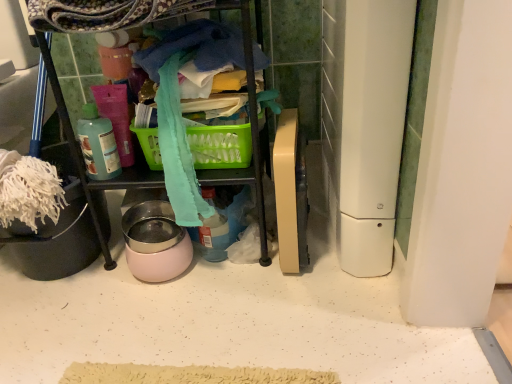
Question: Is translucent plastic bottle at upper left further to camera compared to green plastic picnic basket at center?

Choices:
 (A) yes
 (B) no

Answer: (B)

Question: Is translucent plastic bottle at upper left to the right of green plastic picnic basket at center from the viewer's perspective?

Choices:
 (A) yes
 (B) no

Answer: (B)

Question: From a real-world perspective, is translucent plastic bottle at upper left located higher than green plastic picnic basket at center?

Choices:
 (A) yes
 (B) no

Answer: (A)

Question: From the image's perspective, is translucent plastic bottle at upper left over green plastic picnic basket at center?

Choices:
 (A) yes
 (B) no

Answer: (B)

Question: Is translucent plastic bottle at upper left at the left side of green plastic picnic basket at center?

Choices:
 (A) yes
 (B) no

Answer: (A)

Question: Does translucent plastic bottle at upper left lie in front of green plastic picnic basket at center?

Choices:
 (A) no
 (B) yes

Answer: (B)

Question: Is translucent plastic bottle at upper left outside white plastic appliance at right, the 2th appliance from the left?

Choices:
 (A) no
 (B) yes

Answer: (B)

Question: Are translucent plastic bottle at upper left and white plastic appliance at right, the 2th appliance from the left, far apart?

Choices:
 (A) yes
 (B) no

Answer: (B)

Question: Considering the relative positions of translucent plastic bottle at upper left and white plastic appliance at right, the 2th appliance from the left, in the image provided, is translucent plastic bottle at upper left behind white plastic appliance at right, the 2th appliance from the left,?

Choices:
 (A) no
 (B) yes

Answer: (B)

Question: Is translucent plastic bottle at upper left to the left of white plastic appliance at right, the 2th appliance from the left, from the viewer's perspective?

Choices:
 (A) no
 (B) yes

Answer: (B)

Question: Does translucent plastic bottle at upper left have a larger size compared to white plastic appliance at right, the 2th appliance from the left?

Choices:
 (A) no
 (B) yes

Answer: (A)

Question: Does translucent plastic bottle at upper left have a greater height compared to white plastic appliance at right, the 1th appliance when ordered from right to left?

Choices:
 (A) no
 (B) yes

Answer: (A)

Question: Is white plastic appliance at right, the 1th appliance when ordered from right to left, shorter than pink glossy bowl at center, the first appliance when ordered from left to right?

Choices:
 (A) yes
 (B) no

Answer: (B)